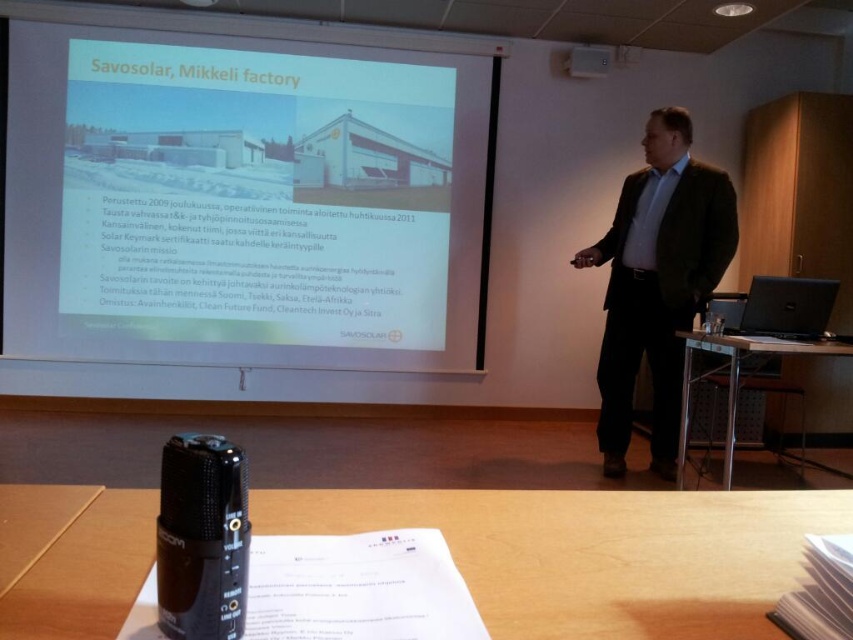
You are sitting at the wooden table with the black microphone. You need to reach both the point at [229,358] and the point at [666,380]. Which point is closer to you?

The point at [666,380] is closer to you because the point at [229,358] is behind it.

You are a technician who needs to adjust the focus of the projector. The projector requires a minimum distance of 1.5 meters to function properly. Based on the scene, can you confirm if the matte black projector at upper center is positioned far enough away from the white matte projector screen at upper center to focus correctly?

The distance between the white matte projector screen at upper center and the matte black projector at upper center is 1.67 meters, which exceeds the minimum required 1.5 meters. Therefore, the projector is positioned far enough to focus correctly.

You are an attendee at the presentation. You need to point out the location of the white matte projector screen at upper center relative to the green matte suit at center. Which side is it on?

The white matte projector screen at upper center is positioned on the left side of the green matte suit at center.